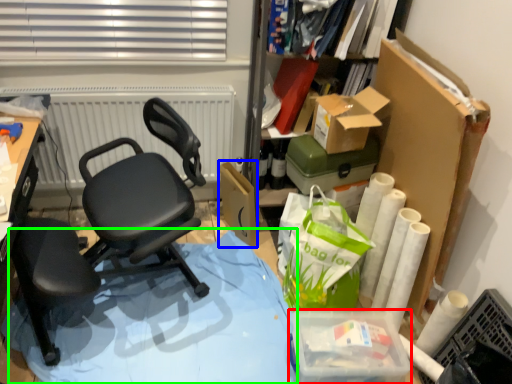
Question: Considering the real-world distances, which object is farthest from storage box (highlighted by a red box)? cardboard box (highlighted by a blue box) or table (highlighted by a green box)?

Choices:
 (A) cardboard box
 (B) table

Answer: (A)